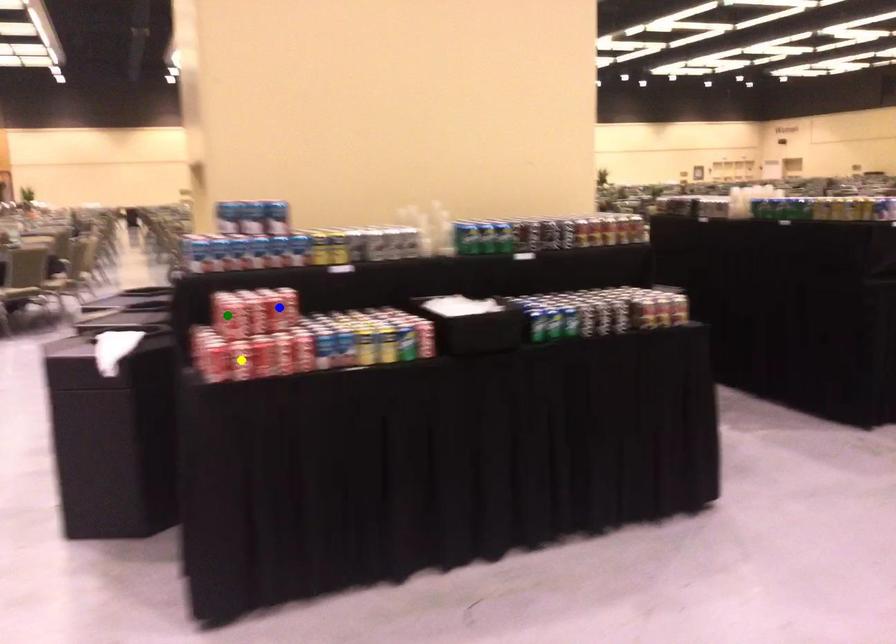
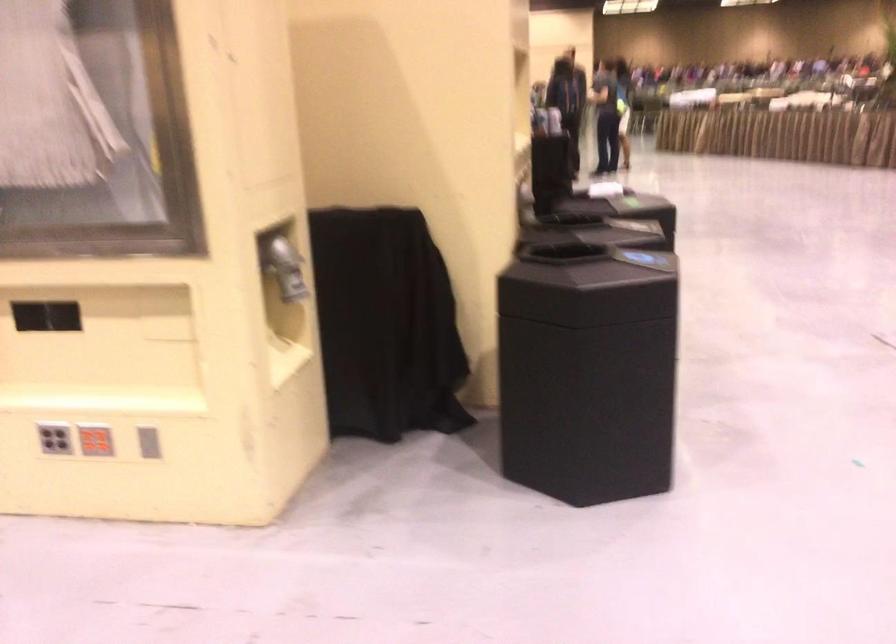
I am providing you with two images of the same scene from different viewpoints. Three points are marked in image1. Which point corresponds to a part or object that is occluded in image2?In image1, three points are marked. Which of them correspond to a part or object that is occluded in image2?Among the three points shown in image1, which one corresponds to a part or object that is no longer visible due to occlusion in image2?

green point, yellow point, blue point